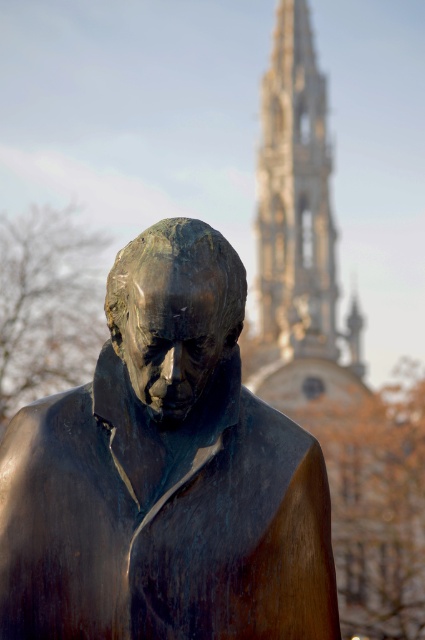
How much distance is there between bronze statue at center and white stone tower at upper center?

bronze statue at center is 134.84 meters away from white stone tower at upper center.

Is bronze statue at center above white stone tower at upper center?

No.

Who is more distant from viewer, (150,420) or (269,266)?

The point (269,266) is behind.

You are a GUI agent. You are given a task and a screenshot of the screen. Output one action in this format:
    pyautogui.click(x=<x>, y=<y>)
    Task: Click on the bronze statue at center
    
    Given the screenshot: What is the action you would take?
    point(164,474)